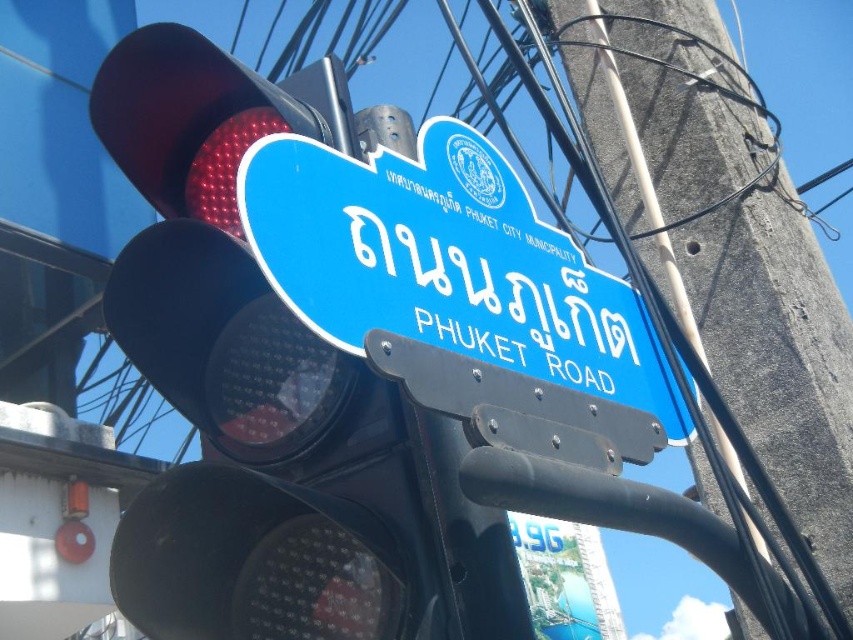
In the scene shown: Does metallic traffic light at upper left come in front of gray concrete telegraph pole at upper center?

That is True.

Does metallic traffic light at upper left have a greater height compared to gray concrete telegraph pole at upper center?

No, metallic traffic light at upper left is not taller than gray concrete telegraph pole at upper center.

What are the coordinates of `metallic traffic light at upper left` in the screenshot? It's located at (270, 401).

Is metallic traffic light at upper left positioned at the back of blue plastic street sign at upper center?

Yes, metallic traffic light at upper left is further from the viewer.

From the picture: Can you confirm if metallic traffic light at upper left is positioned below blue plastic street sign at upper center?

Correct, metallic traffic light at upper left is located below blue plastic street sign at upper center.

Does point (154, 49) lie in front of point (448, 125)?

That is True.

Identify the location of metallic traffic light at upper left. (270, 401).

Between gray concrete telegraph pole at upper center and blue plastic street sign at upper center, which one is positioned higher?

gray concrete telegraph pole at upper center is above.

Can you confirm if gray concrete telegraph pole at upper center is wider than blue plastic street sign at upper center?

Correct, the width of gray concrete telegraph pole at upper center exceeds that of blue plastic street sign at upper center.

Measure the distance between gray concrete telegraph pole at upper center and camera.

gray concrete telegraph pole at upper center is 6.44 feet away from camera.

Identify the location of gray concrete telegraph pole at upper center. (776, 353).